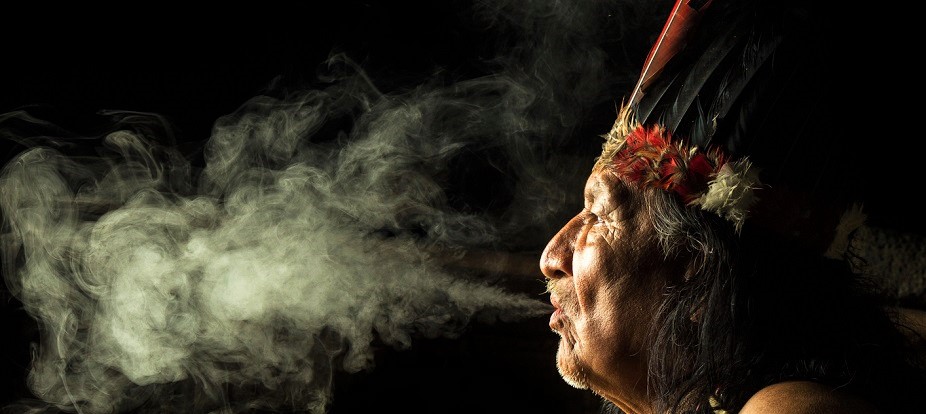
This screenshot has height=414, width=926. I want to click on black feathers in head rest, so click(x=692, y=72), click(x=710, y=91), click(x=727, y=100), click(x=749, y=116).